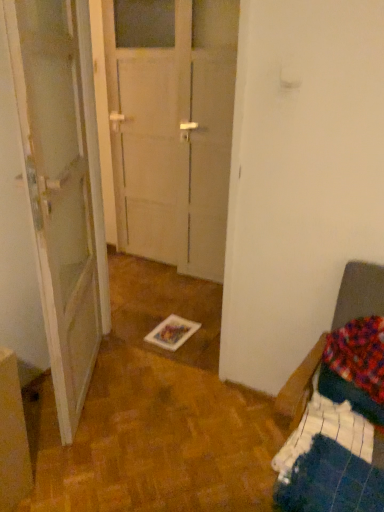
Question: From a real-world perspective, is transparent glass door at center over dark blue fabric bed at right?

Choices:
 (A) yes
 (B) no

Answer: (A)

Question: From the image's perspective, would you say transparent glass door at center is shown under dark blue fabric bed at right?

Choices:
 (A) yes
 (B) no

Answer: (B)

Question: Considering the relative sizes of transparent glass door at center and dark blue fabric bed at right in the image provided, is transparent glass door at center thinner than dark blue fabric bed at right?

Choices:
 (A) yes
 (B) no

Answer: (A)

Question: From the image's perspective, would you say transparent glass door at center is positioned over dark blue fabric bed at right?

Choices:
 (A) no
 (B) yes

Answer: (B)

Question: Considering the relative positions of transparent glass door at center and dark blue fabric bed at right in the image provided, is transparent glass door at center to the left of dark blue fabric bed at right from the viewer's perspective?

Choices:
 (A) yes
 (B) no

Answer: (A)

Question: Does transparent glass door at center lie in front of dark blue fabric bed at right?

Choices:
 (A) no
 (B) yes

Answer: (A)

Question: Does white glossy door at left have a greater height compared to transparent glass door at center?

Choices:
 (A) no
 (B) yes

Answer: (A)

Question: From the image's perspective, is white glossy door at left beneath transparent glass door at center?

Choices:
 (A) yes
 (B) no

Answer: (A)

Question: Does white glossy door at left have a lesser height compared to transparent glass door at center?

Choices:
 (A) no
 (B) yes

Answer: (B)

Question: Is white glossy door at left oriented towards transparent glass door at center?

Choices:
 (A) yes
 (B) no

Answer: (A)

Question: From the image's perspective, is white glossy door at left above transparent glass door at center?

Choices:
 (A) no
 (B) yes

Answer: (A)

Question: Does white glossy door at left have a lesser width compared to transparent glass door at center?

Choices:
 (A) yes
 (B) no

Answer: (B)

Question: Can you confirm if dark blue fabric bed at right is shorter than white glossy door at left?

Choices:
 (A) yes
 (B) no

Answer: (A)